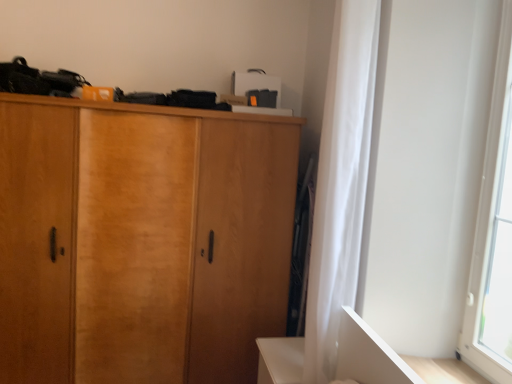
Question: Is white sheer curtain at right positioned before wooden cabinet at center?

Choices:
 (A) yes
 (B) no

Answer: (A)

Question: From the image's perspective, is white sheer curtain at right on top of wooden cabinet at center?

Choices:
 (A) no
 (B) yes

Answer: (B)

Question: From a real-world perspective, is white sheer curtain at right physically below wooden cabinet at center?

Choices:
 (A) no
 (B) yes

Answer: (A)

Question: Is white sheer curtain at right not within wooden cabinet at center?

Choices:
 (A) yes
 (B) no

Answer: (A)

Question: Considering the relative positions of white sheer curtain at right and wooden cabinet at center in the image provided, is white sheer curtain at right to the right of wooden cabinet at center from the viewer's perspective?

Choices:
 (A) no
 (B) yes

Answer: (B)

Question: Does white sheer curtain at right have a larger size compared to wooden cabinet at center?

Choices:
 (A) no
 (B) yes

Answer: (A)

Question: Does transparent glass window at right lie behind white sheer curtain at right?

Choices:
 (A) yes
 (B) no

Answer: (B)

Question: From a real-world perspective, is transparent glass window at right positioned over white sheer curtain at right based on gravity?

Choices:
 (A) no
 (B) yes

Answer: (B)

Question: Is transparent glass window at right with white sheer curtain at right?

Choices:
 (A) yes
 (B) no

Answer: (B)

Question: Is transparent glass window at right not inside white sheer curtain at right?

Choices:
 (A) no
 (B) yes

Answer: (B)

Question: From the image's perspective, does transparent glass window at right appear lower than white sheer curtain at right?

Choices:
 (A) yes
 (B) no

Answer: (B)

Question: Can you confirm if transparent glass window at right is positioned to the left of white sheer curtain at right?

Choices:
 (A) yes
 (B) no

Answer: (B)

Question: Is wooden cabinet at center thinner than white sheer curtain at right?

Choices:
 (A) yes
 (B) no

Answer: (B)